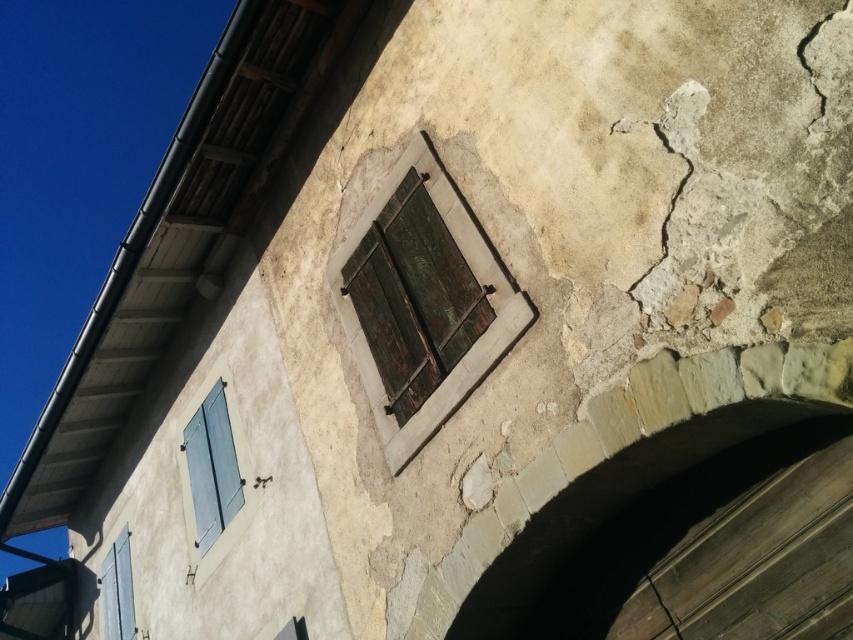
You are an architect inspecting the old building. You notice a point at coordinates (413, 296). What object is located at that point?

The rusty wood window at center is located at point (413, 296).

You are an architect assessing the building. You need to install a new security camera. The camera requires a mounting bracket that can only be attached to the taller object. Which object should you choose between the rusty wood window at center and the matte gray shutters at lower left?

The rusty wood window at center is much taller than the matte gray shutters at lower left, so you should choose the rusty wood window at center for the camera bracket.

You are a painter standing in front of the old building. You need to paint the blue painted wood shutters at lower left but there is a dark gray concrete crack at lower center in the way. Can you paint the shutters without touching the crack?

The dark gray concrete crack at lower center is behind the blue painted wood shutters at lower left, so you can paint the blue painted wood shutters at lower left without touching the crack because it is not in front of them.